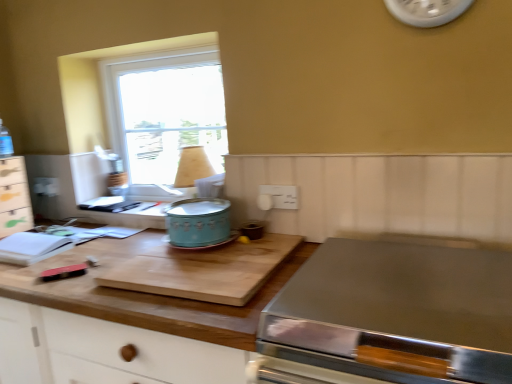
Question: Is clear glass window at upper left wider than white wood drawer at left?

Choices:
 (A) no
 (B) yes

Answer: (A)

Question: Would you say clear glass window at upper left contains white wood drawer at left?

Choices:
 (A) yes
 (B) no

Answer: (B)

Question: Is clear glass window at upper left facing towards white wood drawer at left?

Choices:
 (A) yes
 (B) no

Answer: (B)

Question: Is clear glass window at upper left bigger than white wood drawer at left?

Choices:
 (A) no
 (B) yes

Answer: (B)

Question: Is clear glass window at upper left oriented away from white wood drawer at left?

Choices:
 (A) no
 (B) yes

Answer: (A)

Question: Does point (246, 334) appear closer or farther from the camera than point (390, 251)?

Choices:
 (A) farther
 (B) closer

Answer: (B)

Question: Looking at the image, does wooden cutting board at center seem bigger or smaller compared to stainless steel cooktop at lower right?

Choices:
 (A) big
 (B) small

Answer: (A)

Question: From the image's perspective, relative to stainless steel cooktop at lower right, is wooden cutting board at center above or below?

Choices:
 (A) below
 (B) above

Answer: (A)

Question: Considering their positions, is wooden cutting board at center located in front of or behind stainless steel cooktop at lower right?

Choices:
 (A) front
 (B) behind

Answer: (B)

Question: Is point click(x=157, y=314) closer or farther from the camera than point click(x=31, y=218)?

Choices:
 (A) farther
 (B) closer

Answer: (B)

Question: Is wooden cutting board at center taller or shorter than white wood drawer at left?

Choices:
 (A) tall
 (B) short

Answer: (A)

Question: Considering their positions, is wooden cutting board at center located in front of or behind white wood drawer at left?

Choices:
 (A) behind
 (B) front

Answer: (B)

Question: In terms of width, does wooden cutting board at center look wider or thinner when compared to white wood drawer at left?

Choices:
 (A) thin
 (B) wide

Answer: (B)

Question: Considering the positions of stainless steel cooktop at lower right and white wood drawer at left in the image, is stainless steel cooktop at lower right wider or thinner than white wood drawer at left?

Choices:
 (A) thin
 (B) wide

Answer: (B)

Question: From a real-world perspective, is stainless steel cooktop at lower right physically located above or below white wood drawer at left?

Choices:
 (A) below
 (B) above

Answer: (A)